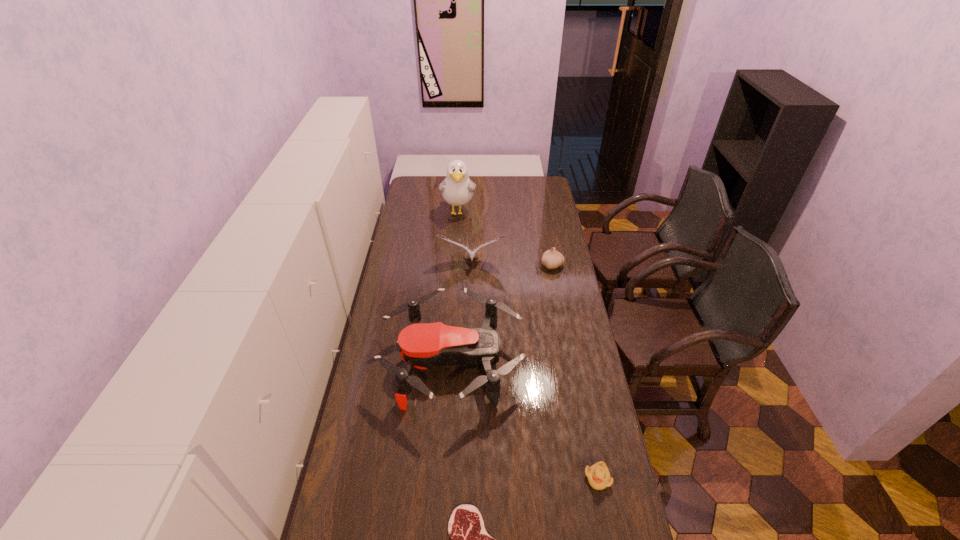
This screenshot has height=540, width=960. I want to click on the farthest object, so click(x=457, y=189).

This screenshot has height=540, width=960. Find the location of `the taller gull`. the taller gull is located at coordinates (457, 189).

Locate an element on the screen. the nearer gull is located at coordinates (471, 253).

Identify the location of drone. (421, 345).

Where is `garlic`? garlic is located at coordinates (551, 259).

At what (x,y) coordinates should I click in order to perform the action: click on duckling. Please return your answer as a coordinate pair (x, y). Looking at the image, I should click on (598, 475).

Locate an element on the screen. The width and height of the screenshot is (960, 540). the second nearest object is located at coordinates (598, 475).

The image size is (960, 540). Find the location of `free location located on the beak of the farthest object`. free location located on the beak of the farthest object is located at coordinates (456, 249).

Find the location of a particular element. Image resolution: width=960 pixels, height=540 pixels. vacant space located 0.310m at the tip of the beak of the nearer gull is located at coordinates (471, 323).

Identify the location of vacant area situated 0.050m on the camera side of the drone. The height and width of the screenshot is (540, 960). (536, 362).